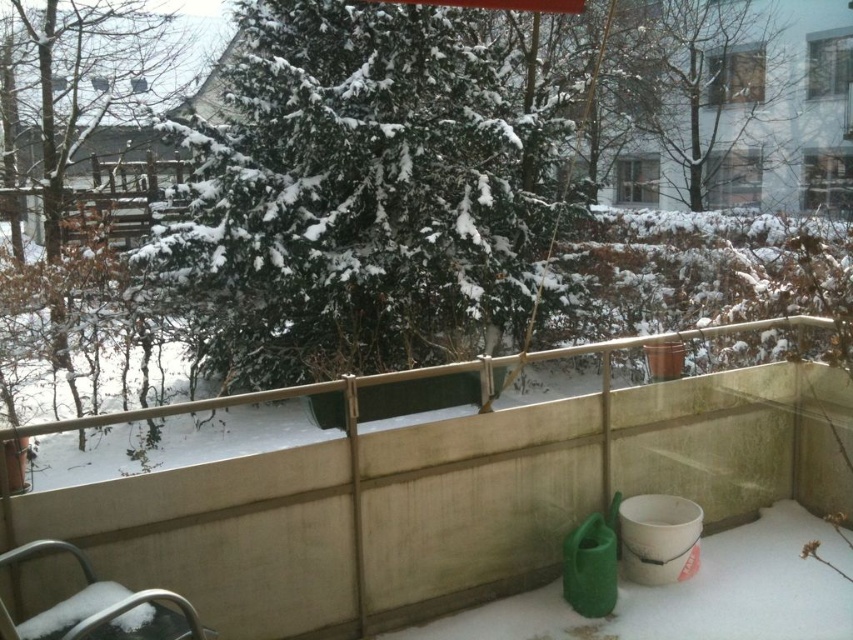
Question: Can you confirm if snow-covered evergreen tree at upper center is smaller than metallic silver chair at lower left?

Choices:
 (A) no
 (B) yes

Answer: (A)

Question: Among these points, which one is nearest to the camera?

Choices:
 (A) (762, 144)
 (B) (511, 170)
 (C) (154, 588)

Answer: (C)

Question: Which is nearer to the metallic silver chair at lower left?

Choices:
 (A) snow-covered evergreen tree at upper center
 (B) green textured tree at upper center

Answer: (A)

Question: Is snow-covered evergreen tree at upper center positioned in front of metallic silver chair at lower left?

Choices:
 (A) no
 (B) yes

Answer: (A)

Question: Considering the real-world distances, which object is closest to the metallic silver chair at lower left?

Choices:
 (A) snow-covered evergreen tree at upper center
 (B) green textured tree at upper center

Answer: (A)

Question: Does snow-covered evergreen tree at upper center appear over metallic silver chair at lower left?

Choices:
 (A) no
 (B) yes

Answer: (B)